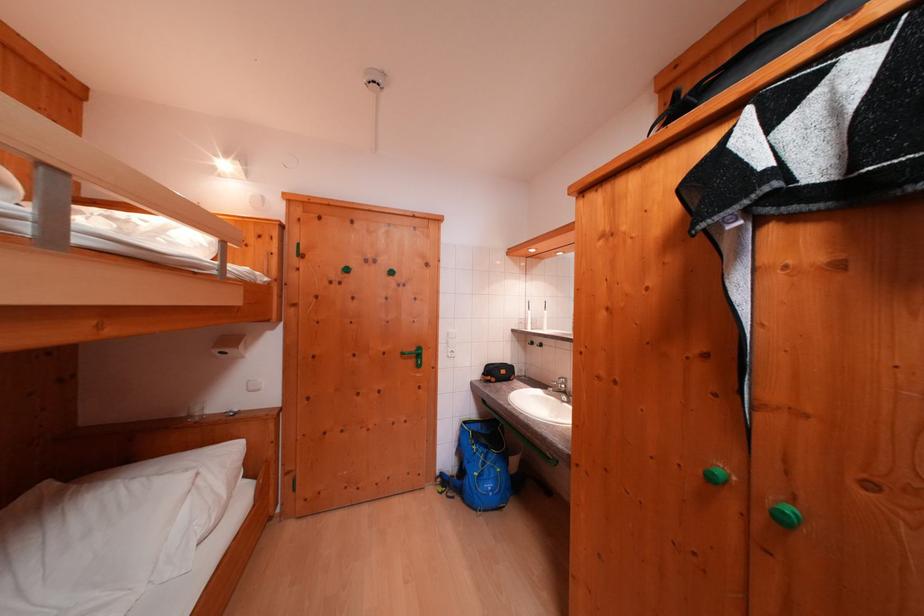
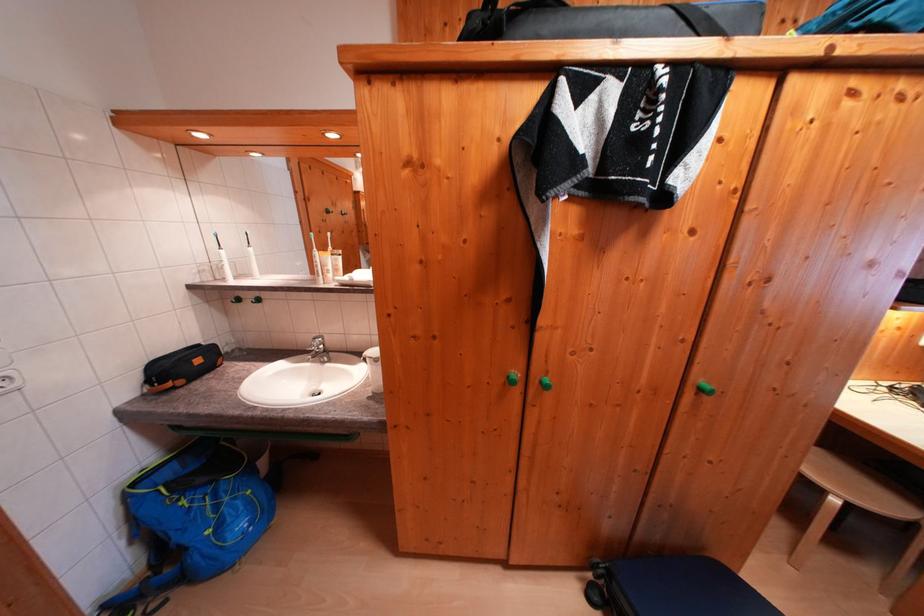
Where in the second image is the point corresponding to pixel 516 467 from the first image?

(262, 476)